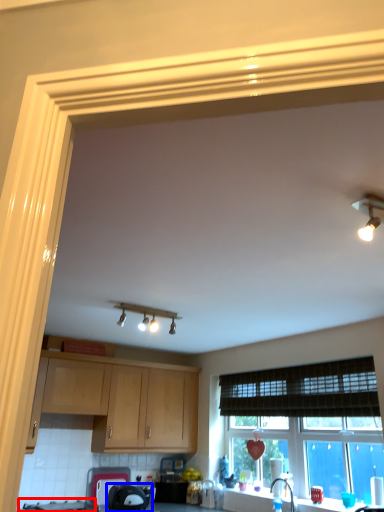
Question: Which point is further to the camera, gas stove (highlighted by a red box) or appliance (highlighted by a blue box)?

Choices:
 (A) gas stove
 (B) appliance

Answer: (B)